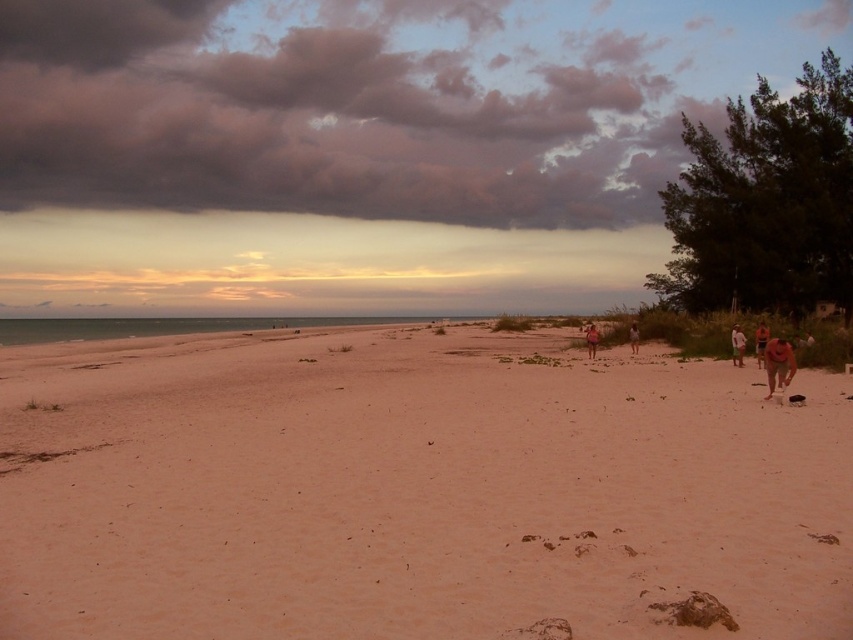
You are standing on the sandy beach at center and looking towards the dark pink fluffy cloud at upper center. Which direction should you face to have the cloud to your left?

Since the sandy beach at center is to the right of dark pink fluffy cloud at upper center, if you are standing on the sandy beach at center and want the dark pink fluffy cloud at upper center to be to your left, you should face towards the west direction.

You are standing on the sandy beach at center. If you walk straight ahead, which direction will you face? Please answer with the compass direction.

The sandy beach at center is located at point coordinates of (412, 490). Since the beach is at the center, walking straight ahead would lead you towards the direction of the horizon where the ocean meets the sky, which is typically north or south depending on the orientation. However, without specific geographical context, the general direction would be towards the ocean, which is east or west during sunrise or sunset. Given the scene depicts sunrise or sunset, the sun is either rising in the east or sets